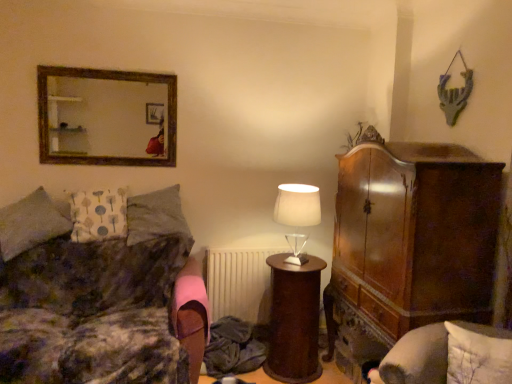
What is the approximate height of white fabric pillow at left, placed as the 2th pillow when sorted from left to right?

The height of white fabric pillow at left, placed as the 2th pillow when sorted from left to right, is 47.69 centimeters.

Identify the location of wooden frame mirror at upper left. This screenshot has width=512, height=384. (106, 117).

Find the location of a particular element. Image resolution: width=512 pixels, height=384 pixels. velvet gray swivel chair at lower right, marked as the second swivel chair in a back-to-front arrangement is located at coordinates (449, 356).

Locate an element on the screen. This screenshot has width=512, height=384. brown polished wood side table at center is located at coordinates (294, 320).

This screenshot has height=384, width=512. What do you see at coordinates (239, 283) in the screenshot?
I see `white matte radiator at center` at bounding box center [239, 283].

Identify the location of white fabric pillow at left, which is the 3th pillow from right to left. (98, 214).

Is white fabric pillow at left, the 1th pillow from the left, far away from pink fabric swivel chair at lower center, positioned as the 1th swivel chair in left-to-right order?

white fabric pillow at left, the 1th pillow from the left, is near pink fabric swivel chair at lower center, positioned as the 1th swivel chair in left-to-right order, not far away.

Who is bigger, white fabric pillow at left, which is counted as the 4th pillow, starting from the right, or pink fabric swivel chair at lower center, positioned as the 2th swivel chair in front-to-back order?

Bigger between the two is white fabric pillow at left, which is counted as the 4th pillow, starting from the right.

Does white fabric pillow at left, the 1th pillow from the left, have a lesser height compared to pink fabric swivel chair at lower center, the 2th swivel chair positioned from the right?

Incorrect, the height of white fabric pillow at left, the 1th pillow from the left, does not fall short of that of pink fabric swivel chair at lower center, the 2th swivel chair positioned from the right.

Is velvet gray swivel chair at lower right, which is counted as the second swivel chair, starting from the left, further to the viewer compared to white fabric pillow at left, which is the 3th pillow from right to left?

No, it is not.

Considering the sizes of objects velvet gray swivel chair at lower right, which is counted as the second swivel chair, starting from the left, and white fabric pillow at left, placed as the 2th pillow when sorted from left to right, in the image provided, who is wider, velvet gray swivel chair at lower right, which is counted as the second swivel chair, starting from the left, or white fabric pillow at left, placed as the 2th pillow when sorted from left to right,?

With larger width is velvet gray swivel chair at lower right, which is counted as the second swivel chair, starting from the left.

Is velvet gray swivel chair at lower right, which is the first swivel chair in front-to-back order, with white fabric pillow at left, placed as the 2th pillow when sorted from left to right?

No, velvet gray swivel chair at lower right, which is the first swivel chair in front-to-back order, is not touching white fabric pillow at left, placed as the 2th pillow when sorted from left to right.

Looking at this image, from a real-world perspective, is white fabric pillow at left, placed as the 2th pillow when sorted from left to right, physically located above or below white matte radiator at center?

In terms of real-world spatial position, white fabric pillow at left, placed as the 2th pillow when sorted from left to right, is above white matte radiator at center.

Are white fabric pillow at left, which is the 3th pillow from right to left, and white matte radiator at center located far from each other?

white fabric pillow at left, which is the 3th pillow from right to left, is actually quite close to white matte radiator at center.

The image size is (512, 384). Find the location of `radiator below the white fabric pillow at left, placed as the 2th pillow when sorted from left to right (from the image's perspective)`. radiator below the white fabric pillow at left, placed as the 2th pillow when sorted from left to right (from the image's perspective) is located at coordinates (239, 283).

Can you confirm if white fabric pillow at left, which is the 3th pillow from right to left, is positioned to the right of white matte radiator at center?

Incorrect, white fabric pillow at left, which is the 3th pillow from right to left, is not on the right side of white matte radiator at center.

I want to click on table lamp on the right side of white fabric pillow at left, which is counted as the 4th pillow, starting from the right, so click(297, 205).

Based on their positions, is white matte table lamp at center located to the left or right of white fabric pillow at left, the 1th pillow from the left?

white matte table lamp at center is to the right of white fabric pillow at left, the 1th pillow from the left.

From a real-world perspective, which object stands above the other?

In real-world perspective, white matte table lamp at center is above.

Looking at this image, between gray fabric pillow at left, the 2th pillow positioned from the right, and white textured pillow at lower right, the 4th pillow from the left, which one has smaller width?

With smaller width is white textured pillow at lower right, the 4th pillow from the left.

The height and width of the screenshot is (384, 512). What are the coordinates of `the 2nd pillow positioned above the white textured pillow at lower right, which is counted as the 1th pillow, starting from the right (from a real-world perspective)` in the screenshot? It's located at (157, 216).

Considering the relative sizes of gray fabric pillow at left, the 2th pillow positioned from the right, and white textured pillow at lower right, the 4th pillow from the left, in the image provided, is gray fabric pillow at left, the 2th pillow positioned from the right, smaller than white textured pillow at lower right, the 4th pillow from the left,?

Incorrect, gray fabric pillow at left, the 2th pillow positioned from the right, is not smaller in size than white textured pillow at lower right, the 4th pillow from the left.

Looking at this image, are gray fabric pillow at left, acting as the 3th pillow starting from the left, and white textured pillow at lower right, which is counted as the 1th pillow, starting from the right, far apart?

gray fabric pillow at left, acting as the 3th pillow starting from the left, is far away from white textured pillow at lower right, which is counted as the 1th pillow, starting from the right.

Considering the sizes of white matte radiator at center and velvet gray swivel chair at lower right, marked as the second swivel chair in a back-to-front arrangement, in the image, is white matte radiator at center taller or shorter than velvet gray swivel chair at lower right, marked as the second swivel chair in a back-to-front arrangement,?

In the image, white matte radiator at center appears to be taller than velvet gray swivel chair at lower right, marked as the second swivel chair in a back-to-front arrangement.

Does white matte radiator at center have a smaller size compared to velvet gray swivel chair at lower right, which is the first swivel chair in front-to-back order?

Correct, white matte radiator at center occupies less space than velvet gray swivel chair at lower right, which is the first swivel chair in front-to-back order.

Would you say white matte radiator at center is outside velvet gray swivel chair at lower right, marked as the second swivel chair in a back-to-front arrangement?

Yes, white matte radiator at center is not within velvet gray swivel chair at lower right, marked as the second swivel chair in a back-to-front arrangement.

From the image's perspective, is white matte radiator at center on top of velvet gray swivel chair at lower right, marked as the second swivel chair in a back-to-front arrangement?

Yes, from the image's perspective, white matte radiator at center is over velvet gray swivel chair at lower right, marked as the second swivel chair in a back-to-front arrangement.

Which is further, (123, 128) or (304, 342)?

The point (123, 128) is farther from the camera.

Is wooden frame mirror at upper left behind brown polished wood side table at center?

Yes.

Does wooden frame mirror at upper left turn towards brown polished wood side table at center?

No, wooden frame mirror at upper left is not turned towards brown polished wood side table at center.

Considering the relative sizes of wooden frame mirror at upper left and brown polished wood side table at center in the image provided, is wooden frame mirror at upper left smaller than brown polished wood side table at center?

Correct, wooden frame mirror at upper left occupies less space than brown polished wood side table at center.

Locate an element on the screen. The image size is (512, 384). the 3rd pillow counting from the left of the pink fabric swivel chair at lower center, the 2th swivel chair positioned from the right is located at coordinates (31, 223).

Locate an element on the screen. The image size is (512, 384). pillow that is the 4th one above the velvet gray swivel chair at lower right, marked as the second swivel chair in a back-to-front arrangement (from a real-world perspective) is located at coordinates (98, 214).

Consider the image. When comparing their distances from wooden frame mirror at upper left, does brown polished wood side table at center or velvet gray swivel chair at lower right, marked as the second swivel chair in a back-to-front arrangement, seem further?

velvet gray swivel chair at lower right, marked as the second swivel chair in a back-to-front arrangement.

From the picture: Looking at the image, which one is located further to white fabric pillow at left, placed as the 2th pillow when sorted from left to right, pink fabric swivel chair at lower center, positioned as the 1th swivel chair in left-to-right order, or velvet-like brown couch at left?

pink fabric swivel chair at lower center, positioned as the 1th swivel chair in left-to-right order.

Estimate the real-world distances between objects in this image. Which object is closer to velvet gray swivel chair at lower right, marked as the second swivel chair in a back-to-front arrangement, white matte table lamp at center or white fabric pillow at left, which is the 3th pillow from right to left?

Based on the image, white matte table lamp at center appears to be nearer to velvet gray swivel chair at lower right, marked as the second swivel chair in a back-to-front arrangement.

Estimate the real-world distances between objects in this image. Which object is closer to white textured pillow at lower right, the 4th pillow from the left, white fabric pillow at left, the 1th pillow from the left, or brown polished wood side table at center?

brown polished wood side table at center.

Based on their spatial positions, is brown polished wood side table at center or white fabric pillow at left, which is the 3th pillow from right to left, further from wooden frame mirror at upper left?

brown polished wood side table at center is further to wooden frame mirror at upper left.

When comparing their distances from white matte radiator at center, does wooden frame mirror at upper left or velvet-like brown couch at left seem further?

wooden frame mirror at upper left is positioned further to the anchor white matte radiator at center.

Considering their positions, is brown polished wood side table at center positioned further to white fabric pillow at left, which is the 3th pillow from right to left, than velvet gray swivel chair at lower right, which is counted as the second swivel chair, starting from the left?

velvet gray swivel chair at lower right, which is counted as the second swivel chair, starting from the left, is further to white fabric pillow at left, which is the 3th pillow from right to left.

Considering their positions, is velvet gray swivel chair at lower right, which ranks as the first swivel chair in right-to-left order, positioned further to brown polished wood side table at center than white matte radiator at center?

The object further to brown polished wood side table at center is velvet gray swivel chair at lower right, which ranks as the first swivel chair in right-to-left order.

The width and height of the screenshot is (512, 384). Find the location of `swivel chair between velvet-like brown couch at left and white matte radiator at center along the z-axis`. swivel chair between velvet-like brown couch at left and white matte radiator at center along the z-axis is located at coordinates (191, 315).

You are a GUI agent. You are given a task and a screenshot of the screen. Output one action in this format:
    pyautogui.click(x=<x>, y=<y>)
    Task: Click on the swivel chair between white fabric pillow at left, which is the 3th pillow from right to left, and brown polished wood side table at center, in the horizontal direction
    Image resolution: width=512 pixels, height=384 pixels.
    Given the screenshot: What is the action you would take?
    pyautogui.click(x=191, y=315)

Find the location of a particular element. studio couch between white fabric pillow at left, which is the 3th pillow from right to left, and white matte table lamp at center from left to right is located at coordinates (100, 294).

Image resolution: width=512 pixels, height=384 pixels. In order to click on swivel chair between gray fabric pillow at left, acting as the 3th pillow starting from the left, and velvet gray swivel chair at lower right, which ranks as the first swivel chair in right-to-left order, from left to right in this screenshot , I will do `click(191, 315)`.